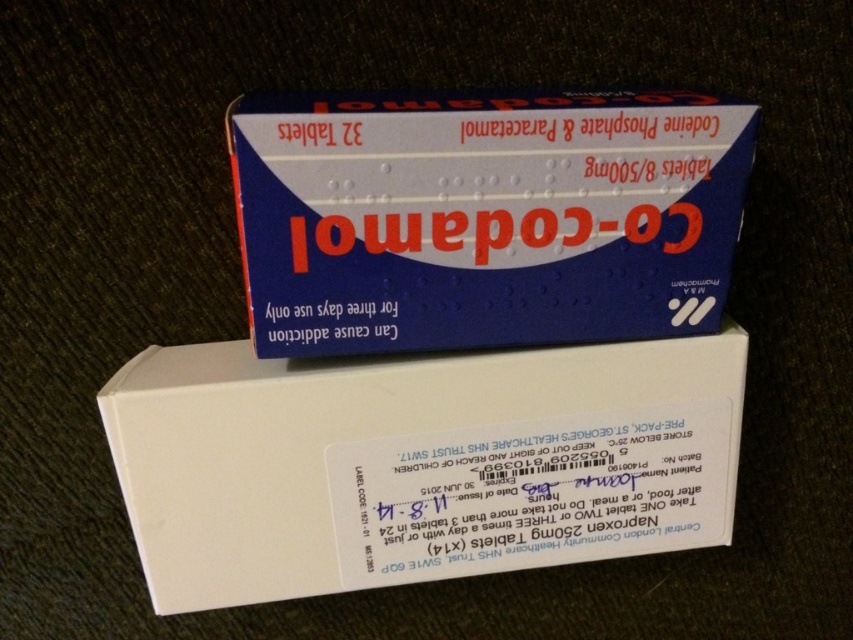
Is white cardboard box at center to the left of blue cardboard box at upper center from the viewer's perspective?

Indeed, white cardboard box at center is positioned on the left side of blue cardboard box at upper center.

Is white cardboard box at center above blue cardboard box at upper center?

No.

Measure the distance between point (566, 560) and camera.

Point (566, 560) is 3.67 feet away from camera.

Image resolution: width=853 pixels, height=640 pixels. What are the coordinates of `white cardboard box at center` in the screenshot? It's located at (416, 464).